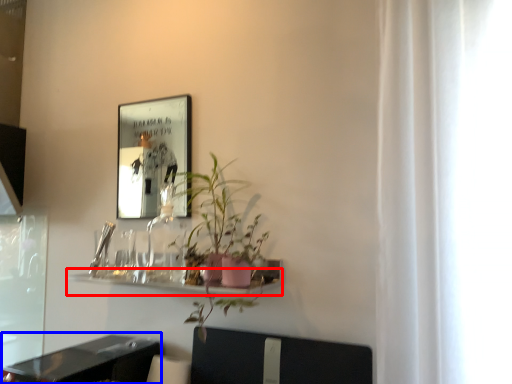
Question: Which point is further to the camera, shelf (highlighted by a red box) or table (highlighted by a blue box)?

Choices:
 (A) shelf
 (B) table

Answer: (A)